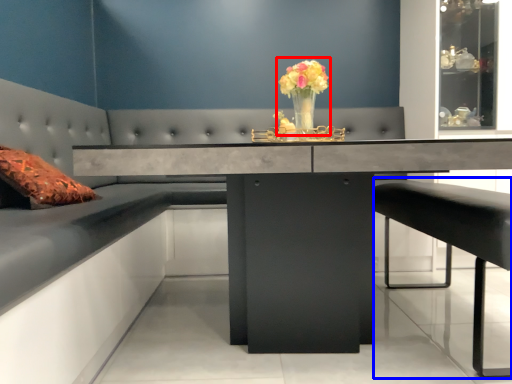
Question: Among these objects, which one is nearest to the camera, floral arrangement (highlighted by a red box) or bar stool (highlighted by a blue box)?

Choices:
 (A) floral arrangement
 (B) bar stool

Answer: (B)